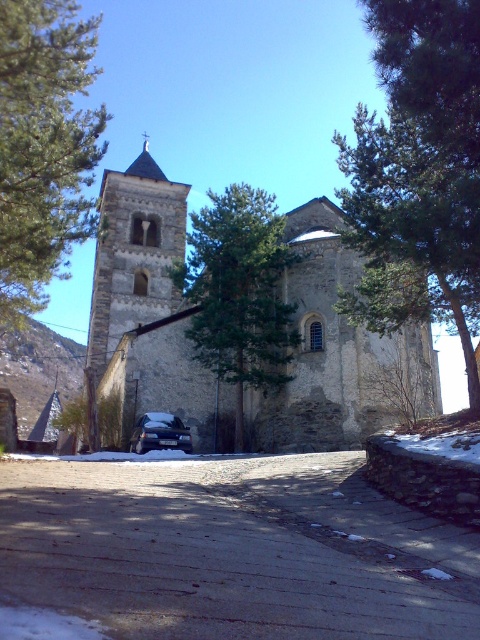
Can you confirm if green leafy tree at left is positioned below satin black car at center?

No, green leafy tree at left is not below satin black car at center.

Is green leafy tree at left smaller than satin black car at center?

Actually, green leafy tree at left might be larger than satin black car at center.

At what (x,y) coordinates should I click in order to perform the action: click on green leafy tree at left. Please return your answer as a coordinate pair (x, y). The height and width of the screenshot is (640, 480). Looking at the image, I should click on (44, 147).

Can you confirm if green leafy tree at upper right is positioned to the right of green textured tree at center?

Indeed, green leafy tree at upper right is positioned on the right side of green textured tree at center.

Does green leafy tree at upper right have a lesser height compared to green textured tree at center?

In fact, green leafy tree at upper right may be taller than green textured tree at center.

Which is in front, point (363, 200) or point (211, 248)?

Point (363, 200) is more forward.

Identify the location of green leafy tree at upper right. This screenshot has height=640, width=480. (419, 170).

Which is in front, point (457, 32) or point (151, 426)?

Point (457, 32) is more forward.

Does green leafy tree at upper right appear under satin black car at center?

Actually, green leafy tree at upper right is above satin black car at center.

Which is behind, point (342, 160) or point (162, 432)?

The point (162, 432) is behind.

Where is `green leafy tree at upper right`? The image size is (480, 640). green leafy tree at upper right is located at coordinates (419, 170).